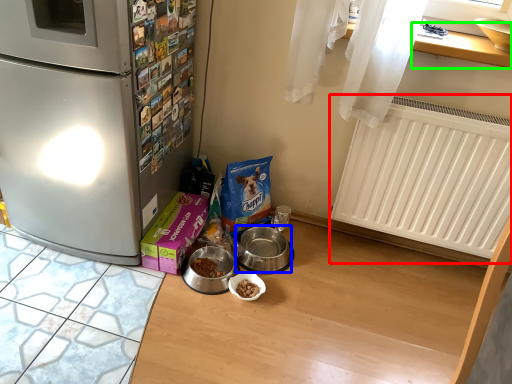
Question: Which is nearer to the radiator (highlighted by a red box)? appliance (highlighted by a blue box) or window sill (highlighted by a green box).

Choices:
 (A) appliance
 (B) window sill

Answer: (B)